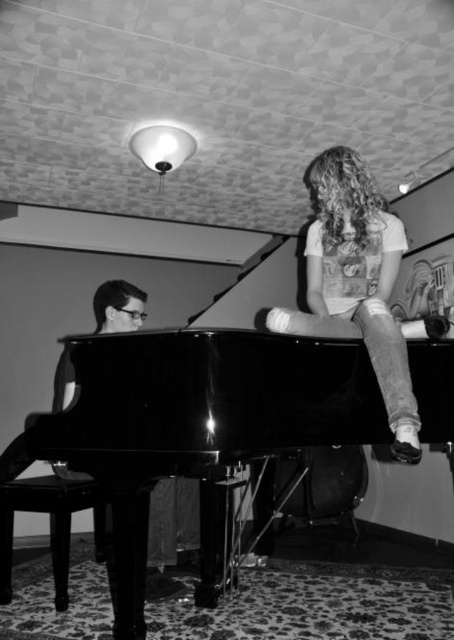
Which is below, black glossy piano at center or denim jeans at upper right?

black glossy piano at center is below.

Consider the image. Who is more distant from viewer, [137,413] or [366,349]?

Point [366,349]

Locate an element on the screen. The height and width of the screenshot is (640, 454). black glossy piano at center is located at coordinates (197, 419).

Between denim jeans at upper right and shiny black stool at lower left, which one has more height?

With more height is denim jeans at upper right.

Who is more distant from viewer, (413, 445) or (100, 531)?

Positioned behind is point (100, 531).

What do you see at coordinates (356, 282) in the screenshot? I see `denim jeans at upper right` at bounding box center [356, 282].

You are a GUI agent. You are given a task and a screenshot of the screen. Output one action in this format:
    pyautogui.click(x=<x>, y=<y>)
    Task: Click on the denim jeans at upper right
    This screenshot has height=640, width=454.
    Given the screenshot: What is the action you would take?
    pyautogui.click(x=356, y=282)

Is black glossy piano at center wider than shiny black stool at lower left?

Yes.

Does black glossy piano at center have a lesser width compared to shiny black stool at lower left?

In fact, black glossy piano at center might be wider than shiny black stool at lower left.

This screenshot has height=640, width=454. What do you see at coordinates (197, 419) in the screenshot?
I see `black glossy piano at center` at bounding box center [197, 419].

This screenshot has width=454, height=640. I want to click on black glossy piano at center, so click(x=197, y=419).